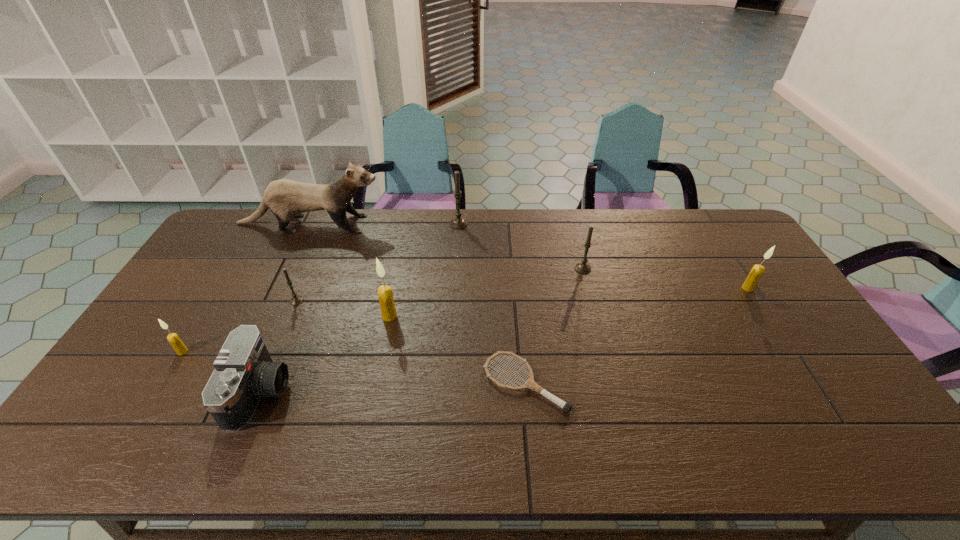
You are a GUI agent. You are given a task and a screenshot of the screen. Output one action in this format:
    pyautogui.click(x=<x>, y=<y>)
    Task: Click on the fifth nearest object
    The width and height of the screenshot is (960, 540).
    Given the screenshot: What is the action you would take?
    tap(296, 299)

Locate an element on the screen. This screenshot has width=960, height=540. the nearest candle is located at coordinates (173, 338).

This screenshot has width=960, height=540. In order to click on the leftmost candle in this screenshot , I will do `click(173, 338)`.

Image resolution: width=960 pixels, height=540 pixels. Identify the location of camera. (244, 371).

Locate an element on the screen. Image resolution: width=960 pixels, height=540 pixels. tennis racket is located at coordinates (530, 383).

At what (x,y) coordinates should I click in order to perform the action: click on gray tennis racket. Please return your answer as a coordinate pair (x, y). Looking at the image, I should click on (530, 383).

You are a GUI agent. You are given a task and a screenshot of the screen. Output one action in this format:
    pyautogui.click(x=<x>, y=<y>)
    Task: Click on the vacant point located 0.340m on the face of the gray ferret
    
    Given the screenshot: What is the action you would take?
    pyautogui.click(x=474, y=224)

The width and height of the screenshot is (960, 540). Identify the location of free space located on the left of the biggest gray candle. (405, 224).

The image size is (960, 540). In order to click on free spot located on the front of the fifth object from left to right in this screenshot , I will do `click(379, 367)`.

This screenshot has height=540, width=960. Identify the location of free space located 0.210m on the front of the second smallest gray candle. (596, 322).